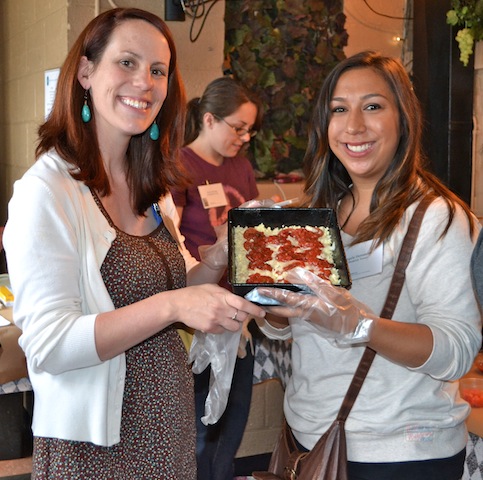
Where is `white poster on wall`? The image size is (483, 480). white poster on wall is located at coordinates (x=47, y=85).